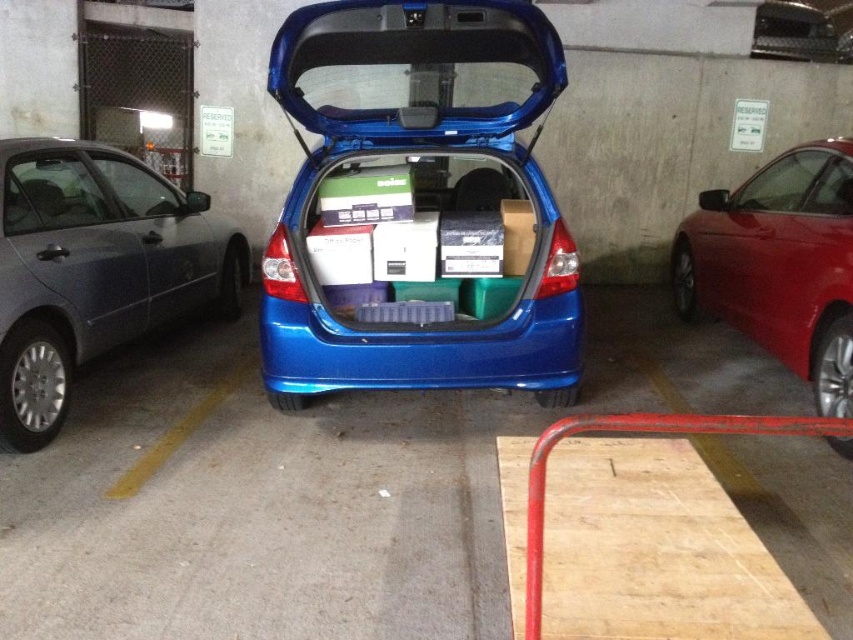
Between matte gray sedan at left and shiny red sedan at right, which one has more height?

With more height is shiny red sedan at right.

You are a GUI agent. You are given a task and a screenshot of the screen. Output one action in this format:
    pyautogui.click(x=<x>, y=<y>)
    Task: Click on the matte gray sedan at left
    
    Given the screenshot: What is the action you would take?
    pyautogui.click(x=94, y=269)

The width and height of the screenshot is (853, 640). I want to click on matte gray sedan at left, so pos(94,269).

Where is `matte gray sedan at left`? matte gray sedan at left is located at coordinates point(94,269).

Is matte gray sedan at left above metallic silver car at center?

Actually, matte gray sedan at left is below metallic silver car at center.

Is point (33, 221) positioned behind point (814, 26)?

No, it is in front of (814, 26).

Between point (26, 228) and point (759, 54), which one is positioned in front?

Point (26, 228)

Identify the location of matte gray sedan at left. The height and width of the screenshot is (640, 853). (94, 269).

From the picture: Can you confirm if blue glossy hatchback at center is positioned above shiny red sedan at right?

Correct, blue glossy hatchback at center is located above shiny red sedan at right.

Between point (473, 355) and point (851, 196), which one is positioned in front?

Point (473, 355) is more forward.

Is point (358, 52) behind point (780, 349)?

No, (358, 52) is in front of (780, 349).

The image size is (853, 640). I want to click on blue glossy hatchback at center, so click(419, 205).